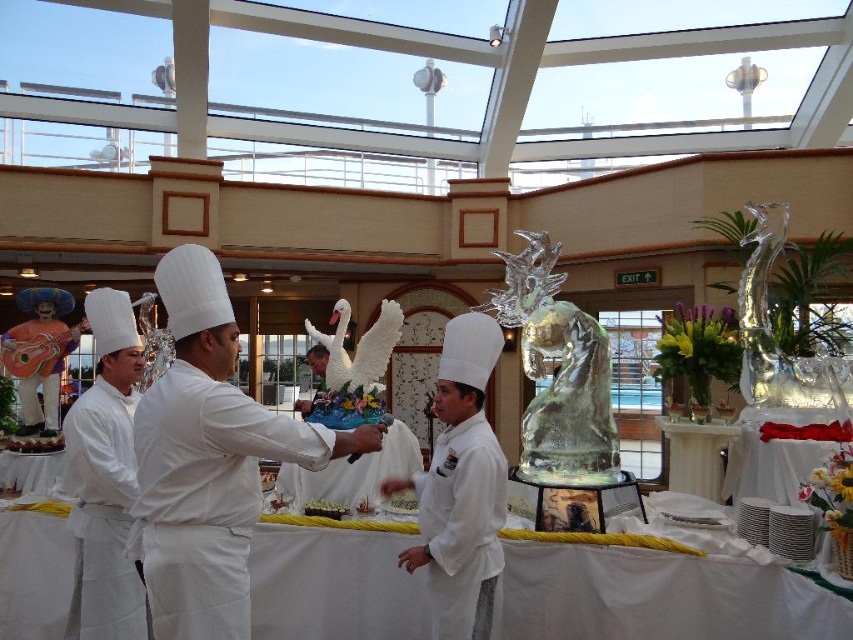
Question: Considering the relative positions of white matte chef's coat at left and white matte chef's coat at center in the image provided, where is white matte chef's coat at left located with respect to white matte chef's coat at center?

Choices:
 (A) right
 (B) left

Answer: (B)

Question: Which point is closer to the camera?

Choices:
 (A) white porcelain plates at right
 (B) white matte chef's coat at left

Answer: (B)

Question: From the image, what is the correct spatial relationship of white matte chef's robe at center in relation to white porcelain plates at right?

Choices:
 (A) left
 (B) right

Answer: (A)

Question: Among these points, which one is nearest to the camera?

Choices:
 (A) [834, 436]
 (B) [451, 522]
 (C) [102, 561]

Answer: (B)

Question: Which point is closer to the camera taking this photo?

Choices:
 (A) (62, 465)
 (B) (328, 435)

Answer: (B)

Question: Is white matte chef's coat at left below white glossy table at center?

Choices:
 (A) yes
 (B) no

Answer: (A)